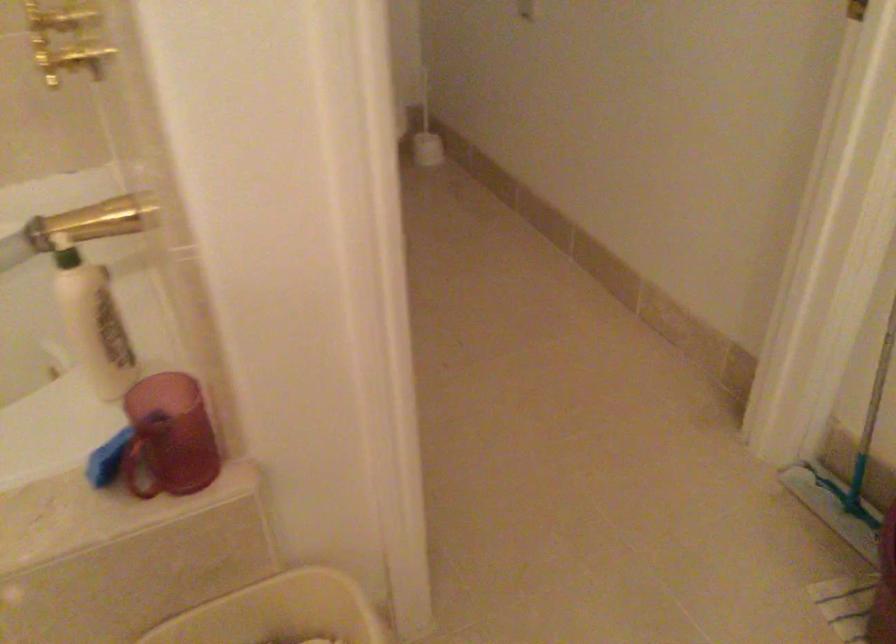
Image resolution: width=896 pixels, height=644 pixels. What do you see at coordinates (426, 366) in the screenshot? I see `the bottle pump dispenser` at bounding box center [426, 366].